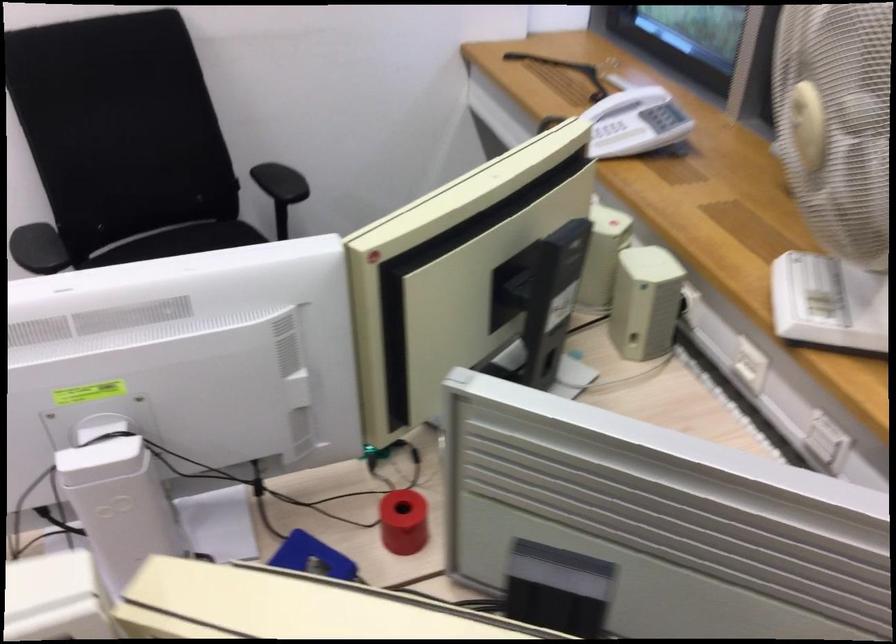
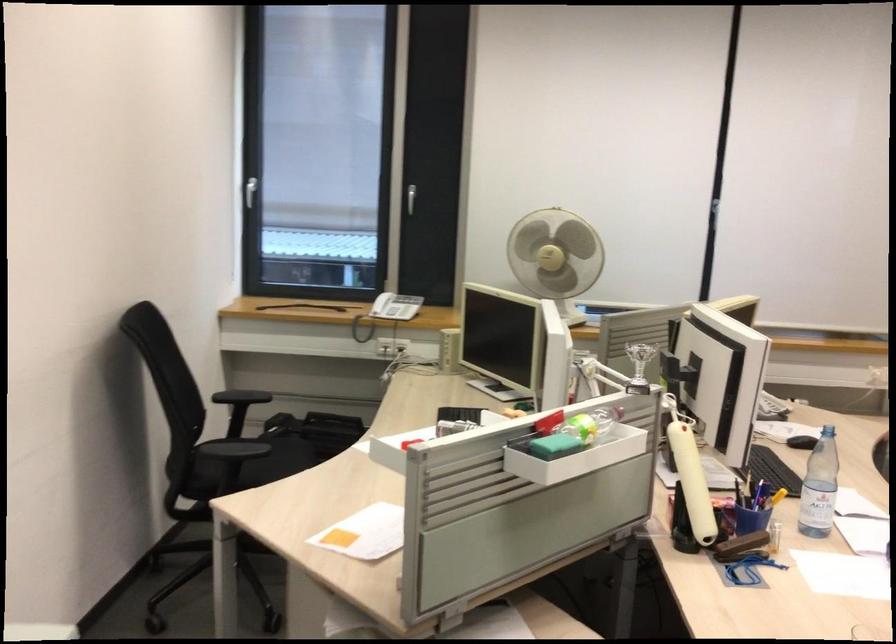
Question: I am providing you with two images of the same scene from different viewpoints. Which of the following objects are not visible in image2?

Choices:
 (A) chair sitting surface
 (B) white cylindrical handle
 (C) remote control
 (D) red tape dispenser

Answer: (D)